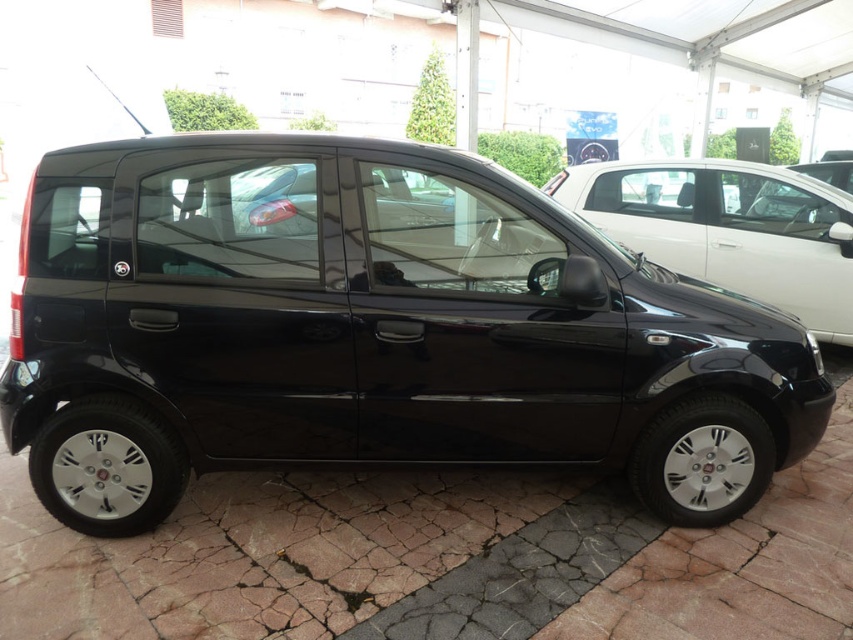
Question: Is glossy black minivan at center thinner than glossy black car at center?

Choices:
 (A) no
 (B) yes

Answer: (A)

Question: Is glossy black minivan at center bigger than glossy black car at center?

Choices:
 (A) yes
 (B) no

Answer: (B)

Question: Which object appears closest to the camera in this image?

Choices:
 (A) glossy black car at center
 (B) glossy black minivan at center

Answer: (B)

Question: Which object appears closest to the camera in this image?

Choices:
 (A) glossy black minivan at center
 (B) glossy black car at center

Answer: (A)

Question: Which point is closer to the camera?

Choices:
 (A) (781, 369)
 (B) (798, 250)

Answer: (A)

Question: Does glossy black minivan at center have a smaller size compared to glossy black car at center?

Choices:
 (A) yes
 (B) no

Answer: (A)